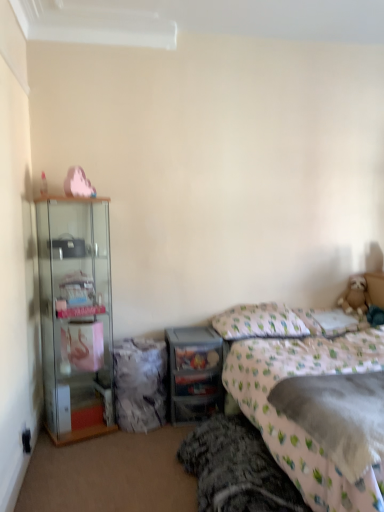
Question: Should I look upward or downward to see clear plastic drawers at center?

Choices:
 (A) down
 (B) up

Answer: (A)

Question: Considering the relative positions of white fabric pillow at upper right, which is the 1th pillow in right-to-left order, and white fabric pillow at center, the second pillow positioned from the right, in the image provided, is white fabric pillow at upper right, which is the 1th pillow in right-to-left order, to the left of white fabric pillow at center, the second pillow positioned from the right, from the viewer's perspective?

Choices:
 (A) no
 (B) yes

Answer: (A)

Question: Considering the relative positions of white fabric pillow at upper right, positioned as the second pillow in left-to-right order, and white fabric pillow at center, the second pillow positioned from the right, in the image provided, is white fabric pillow at upper right, positioned as the second pillow in left-to-right order, to the right of white fabric pillow at center, the second pillow positioned from the right, from the viewer's perspective?

Choices:
 (A) no
 (B) yes

Answer: (B)

Question: Is white fabric pillow at upper right, which is the 1th pillow in right-to-left order, positioned beyond the bounds of white fabric pillow at center, which is counted as the first pillow, starting from the left?

Choices:
 (A) no
 (B) yes

Answer: (B)

Question: Does white fabric pillow at upper right, which is the 1th pillow in right-to-left order, have a greater width compared to white fabric pillow at center, the second pillow positioned from the right?

Choices:
 (A) no
 (B) yes

Answer: (A)

Question: From a real-world perspective, is white fabric pillow at upper right, positioned as the second pillow in left-to-right order, positioned over white fabric pillow at center, the second pillow positioned from the right, based on gravity?

Choices:
 (A) yes
 (B) no

Answer: (B)

Question: Is white fabric pillow at upper right, which is the 1th pillow in right-to-left order, facing away from white fabric pillow at center, the second pillow positioned from the right?

Choices:
 (A) yes
 (B) no

Answer: (B)

Question: Does white fabric pillow at upper right, positioned as the second pillow in left-to-right order, have a greater height compared to fluffy beige teddy bear at right?

Choices:
 (A) no
 (B) yes

Answer: (A)

Question: Is white fabric pillow at upper right, which is the 1th pillow in right-to-left order, with fluffy beige teddy bear at right?

Choices:
 (A) no
 (B) yes

Answer: (A)

Question: Does white fabric pillow at upper right, which is the 1th pillow in right-to-left order, have a lesser height compared to fluffy beige teddy bear at right?

Choices:
 (A) yes
 (B) no

Answer: (A)

Question: Is white fabric pillow at upper right, positioned as the second pillow in left-to-right order, aimed at fluffy beige teddy bear at right?

Choices:
 (A) yes
 (B) no

Answer: (B)

Question: Does white fabric pillow at upper right, which is the 1th pillow in right-to-left order, have a smaller size compared to fluffy beige teddy bear at right?

Choices:
 (A) yes
 (B) no

Answer: (B)

Question: Does clear plastic drawers at center appear on the left side of fluffy beige teddy bear at right?

Choices:
 (A) no
 (B) yes

Answer: (B)